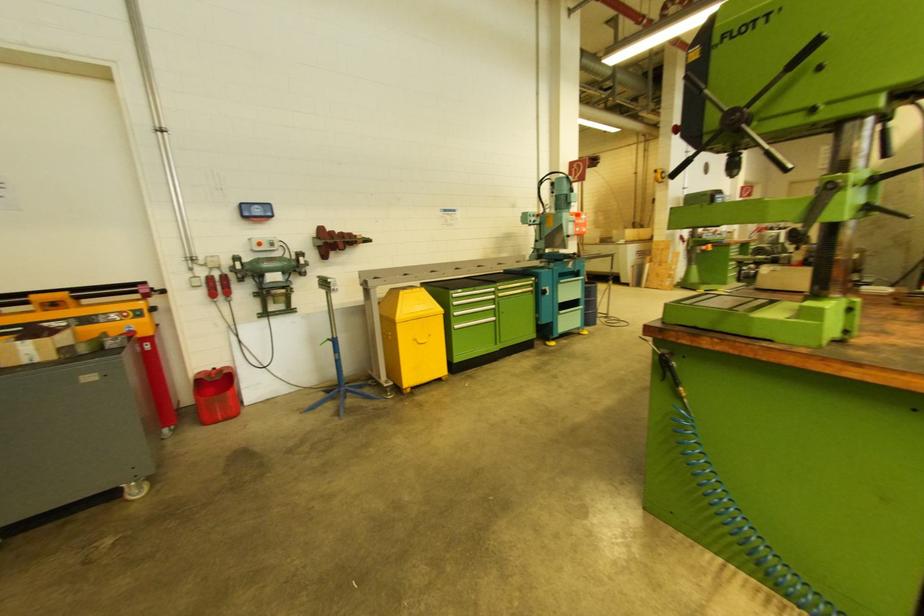
What do you see at coordinates (473, 323) in the screenshot? This screenshot has width=924, height=616. I see `the green cabinet handle` at bounding box center [473, 323].